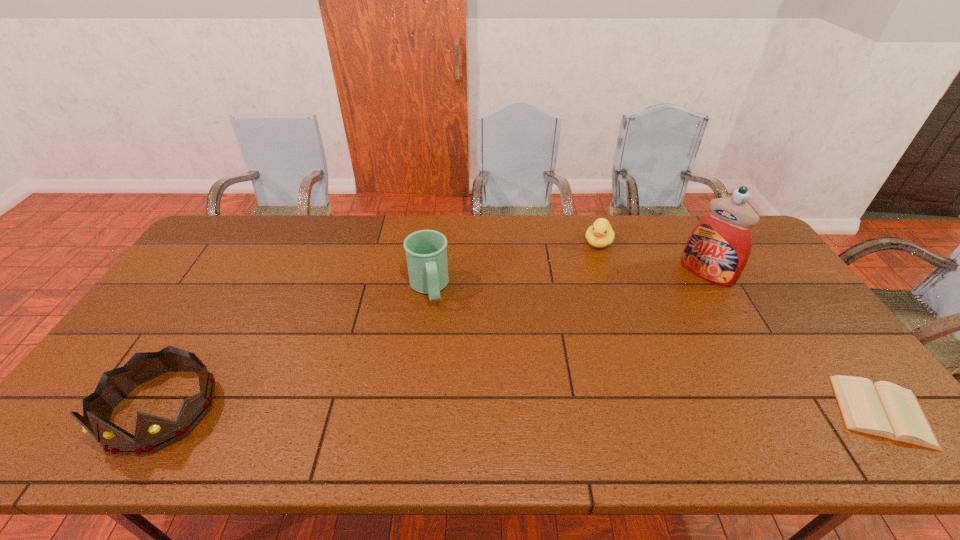
The height and width of the screenshot is (540, 960). I want to click on vacant space on the desktop that is between the leftmost object and the rightmost object and is positioned on the side of the third tallest object with the handle, so click(x=458, y=410).

At what (x,y) coordinates should I click in order to perform the action: click on free spot on the desktop that is between the tiara and the shortest object and is positioned on the front surface of the fourth object from left to right. Please return your answer as a coordinate pair (x, y). Looking at the image, I should click on (578, 410).

Locate an element on the screen. vacant space on the desktop that is between the tiara and the shortest object and is positioned on the beak of the farthest object is located at coordinates (521, 410).